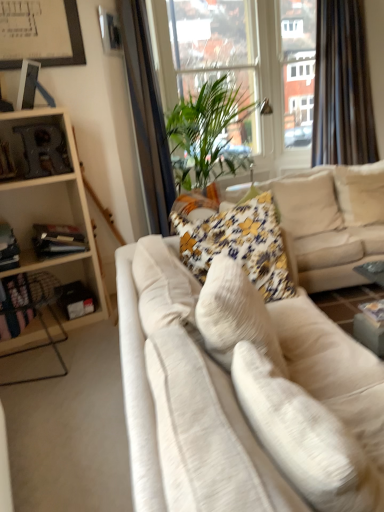
Question: Is transparent glass window screen at upper center positioned beyond the bounds of wooden bookshelf at left?

Choices:
 (A) yes
 (B) no

Answer: (A)

Question: Is transparent glass window screen at upper center shorter than wooden bookshelf at left?

Choices:
 (A) no
 (B) yes

Answer: (A)

Question: From a real-world perspective, does transparent glass window screen at upper center stand above wooden bookshelf at left?

Choices:
 (A) yes
 (B) no

Answer: (A)

Question: Is transparent glass window screen at upper center oriented towards wooden bookshelf at left?

Choices:
 (A) yes
 (B) no

Answer: (B)

Question: Considering the relative sizes of transparent glass window screen at upper center and wooden bookshelf at left in the image provided, is transparent glass window screen at upper center bigger than wooden bookshelf at left?

Choices:
 (A) yes
 (B) no

Answer: (A)

Question: Based on their positions, is floral fabric pillow at center, the 3th pillow in the front-to-back sequence, located to the left or right of white fabric couch at center, placed as the second studio couch when sorted from back to front?

Choices:
 (A) right
 (B) left

Answer: (A)

Question: Considering the positions of floral fabric pillow at center, the 2th pillow when ordered from back to front, and white fabric couch at center, placed as the second studio couch when sorted from back to front, in the image, is floral fabric pillow at center, the 2th pillow when ordered from back to front, wider or thinner than white fabric couch at center, placed as the second studio couch when sorted from back to front,?

Choices:
 (A) wide
 (B) thin

Answer: (B)

Question: Does point (317, 181) appear closer or farther from the camera than point (355, 459)?

Choices:
 (A) closer
 (B) farther

Answer: (B)

Question: Relative to white fabric couch at center, the first studio couch viewed from the front, is floral fabric pillow at center, the 3th pillow in the front-to-back sequence, in front or behind?

Choices:
 (A) front
 (B) behind

Answer: (B)

Question: Is white fabric couch at center, the first studio couch viewed from the front, situated inside black velvet curtain at upper right or outside?

Choices:
 (A) inside
 (B) outside

Answer: (B)

Question: Is white fabric couch at center, placed as the second studio couch when sorted from back to front, bigger or smaller than black velvet curtain at upper right?

Choices:
 (A) small
 (B) big

Answer: (B)

Question: From a real-world perspective, relative to black velvet curtain at upper right, is white fabric couch at center, placed as the second studio couch when sorted from back to front, vertically above or below?

Choices:
 (A) above
 (B) below

Answer: (B)

Question: Is white fabric couch at center, the first studio couch viewed from the front, taller or shorter than black velvet curtain at upper right?

Choices:
 (A) tall
 (B) short

Answer: (B)

Question: Does point (233, 48) appear closer or farther from the camera than point (339, 170)?

Choices:
 (A) farther
 (B) closer

Answer: (A)

Question: Considering the positions of transparent glass window screen at upper center and velvet beige couch at center, the second studio couch when ordered from front to back, in the image, is transparent glass window screen at upper center bigger or smaller than velvet beige couch at center, the second studio couch when ordered from front to back,?

Choices:
 (A) small
 (B) big

Answer: (A)